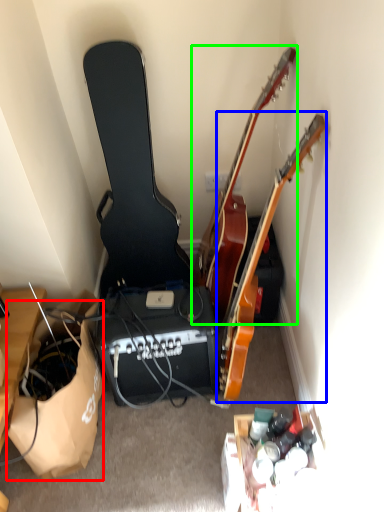
Question: Which object is the farthest from paper bag (highlighted by a red box)? Choose among these: guitar (highlighted by a blue box) or guitar (highlighted by a green box).

Choices:
 (A) guitar
 (B) guitar

Answer: (B)